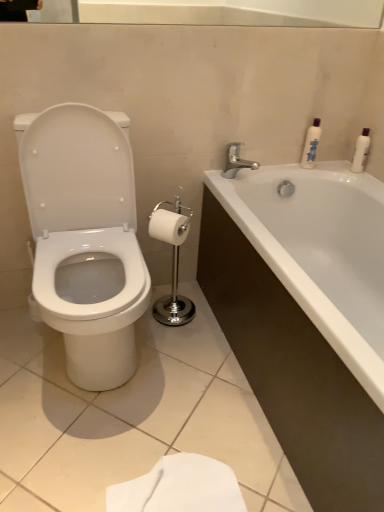
Question: Does white glossy toilet at left have a larger size compared to white glossy bathtub at right?

Choices:
 (A) yes
 (B) no

Answer: (B)

Question: Is white glossy toilet at left not close to white glossy bathtub at right?

Choices:
 (A) yes
 (B) no

Answer: (B)

Question: Can you confirm if white glossy toilet at left is shorter than white glossy bathtub at right?

Choices:
 (A) no
 (B) yes

Answer: (A)

Question: Does white glossy toilet at left turn towards white glossy bathtub at right?

Choices:
 (A) yes
 (B) no

Answer: (B)

Question: Is white glossy toilet at left oriented away from white glossy bathtub at right?

Choices:
 (A) yes
 (B) no

Answer: (B)

Question: Based on their positions, is white plastic bottle at upper right, which ranks as the 1th toiletry in right-to-left order, located to the left or right of white matte toilet paper at center?

Choices:
 (A) right
 (B) left

Answer: (A)

Question: Is white plastic bottle at upper right, which appears as the second toiletry when viewed from the left, taller or shorter than white matte toilet paper at center?

Choices:
 (A) tall
 (B) short

Answer: (A)

Question: Is point (357, 142) positioned closer to the camera than point (165, 239)?

Choices:
 (A) closer
 (B) farther

Answer: (B)

Question: In the image, is white plastic bottle at upper right, which appears as the second toiletry when viewed from the left, positioned in front of or behind white matte toilet paper at center?

Choices:
 (A) front
 (B) behind

Answer: (B)

Question: Considering the positions of white glossy lotion at upper right, the first toiletry positioned from the left, and white matte toilet paper at center in the image, is white glossy lotion at upper right, the first toiletry positioned from the left, taller or shorter than white matte toilet paper at center?

Choices:
 (A) short
 (B) tall

Answer: (B)

Question: From a real-world perspective, is white glossy lotion at upper right, the first toiletry positioned from the left, above or below white matte toilet paper at center?

Choices:
 (A) below
 (B) above

Answer: (B)

Question: Is white glossy lotion at upper right, the first toiletry positioned from the left, to the left or to the right of white matte toilet paper at center in the image?

Choices:
 (A) left
 (B) right

Answer: (B)

Question: Considering their positions, is white glossy lotion at upper right, the first toiletry positioned from the left, located in front of or behind white matte toilet paper at center?

Choices:
 (A) front
 (B) behind

Answer: (B)

Question: Considering the positions of point (139, 297) and point (362, 154), is point (139, 297) closer or farther from the camera than point (362, 154)?

Choices:
 (A) closer
 (B) farther

Answer: (A)

Question: Visually, is white glossy toilet at left positioned to the left or to the right of white plastic bottle at upper right, which ranks as the 1th toiletry in right-to-left order?

Choices:
 (A) right
 (B) left

Answer: (B)